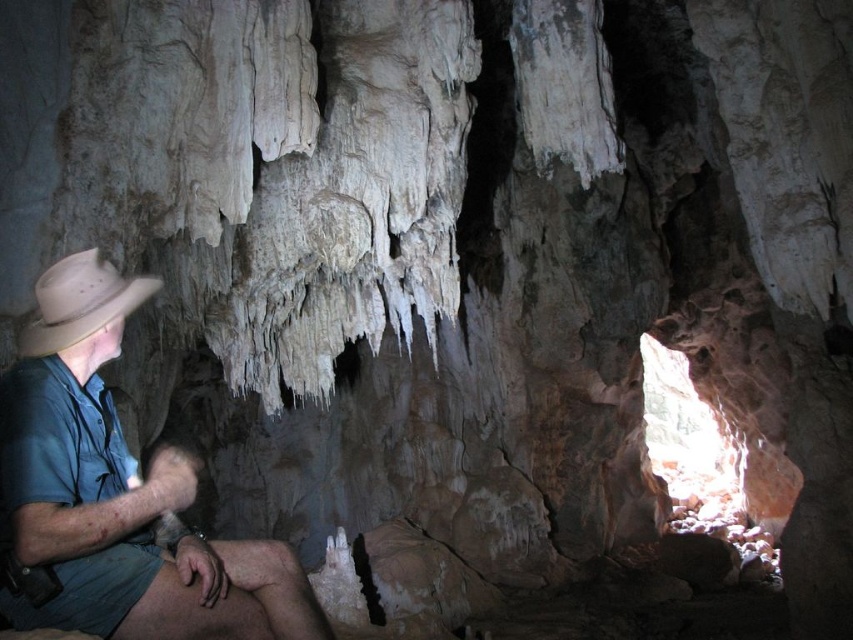
From the picture: You are a cave explorer standing at the entrance and notice two hats on the ground. Which hat is nearer to you, the light brown leather hat at left or the beige felt fedora at left?

The light brown leather hat at left is closer to you than the beige felt fedora at left.